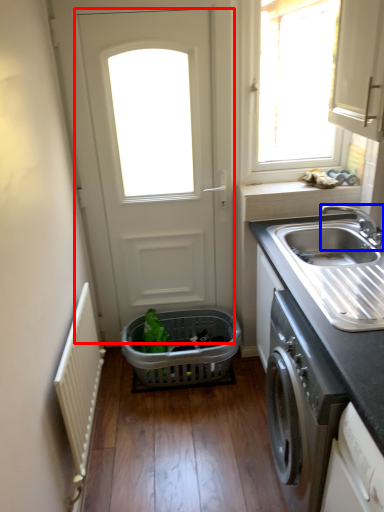
Question: Which point is further to the camera, door (highlighted by a red box) or tap (highlighted by a blue box)?

Choices:
 (A) door
 (B) tap

Answer: (A)